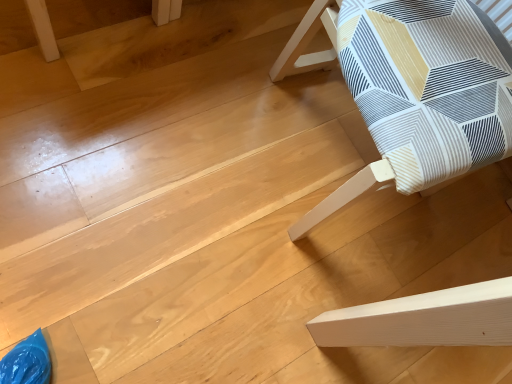
Question: Do you think white fabric chair at right, placed as the first furniture when sorted from right to left, is within light brown wood table at upper left, which appears as the second furniture when viewed from the right, or outside of it?

Choices:
 (A) outside
 (B) inside

Answer: (A)

Question: Considering the positions of point (391, 6) and point (38, 41), is point (391, 6) closer or farther from the camera than point (38, 41)?

Choices:
 (A) closer
 (B) farther

Answer: (A)

Question: From the image's perspective, relative to light brown wood table at upper left, the 1th furniture from the left, is white fabric chair at right, placed as the first furniture when sorted from right to left, above or below?

Choices:
 (A) below
 (B) above

Answer: (A)

Question: Considering the positions of light brown wood table at upper left, the 1th furniture from the left, and white fabric chair at right, which is the second furniture in left-to-right order, in the image, is light brown wood table at upper left, the 1th furniture from the left, bigger or smaller than white fabric chair at right, which is the second furniture in left-to-right order,?

Choices:
 (A) small
 (B) big

Answer: (A)

Question: From a real-world perspective, is light brown wood table at upper left, which appears as the second furniture when viewed from the right, physically located above or below white fabric chair at right, placed as the first furniture when sorted from right to left?

Choices:
 (A) below
 (B) above

Answer: (A)

Question: Considering the positions of point (57, 56) and point (347, 1), is point (57, 56) closer or farther from the camera than point (347, 1)?

Choices:
 (A) closer
 (B) farther

Answer: (B)

Question: From the image's perspective, is light brown wood table at upper left, which appears as the second furniture when viewed from the right, positioned above or below white fabric chair at right, which is the second furniture in left-to-right order?

Choices:
 (A) above
 (B) below

Answer: (A)